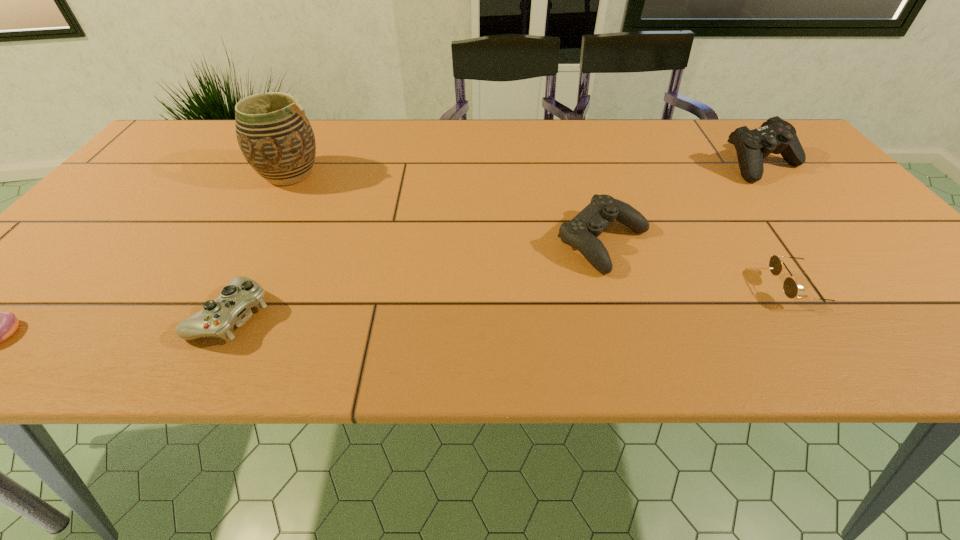
I want to click on free location at the right edge, so click(x=802, y=216).

In the image, there is a desktop. Identify the location of vacant space at the far left corner. (216, 141).

This screenshot has width=960, height=540. In order to click on free spot between the leftmost control and the sunglasses in this screenshot , I will do point(515,302).

At what (x,y) coordinates should I click in order to perform the action: click on empty location between the farthest control and the sunglasses. Please return your answer as a coordinate pair (x, y). This screenshot has height=540, width=960. Looking at the image, I should click on (780, 227).

The height and width of the screenshot is (540, 960). I want to click on free space between the second tallest object and the sunglasses, so tap(780, 227).

Where is `free space between the pottery and the nearest control`? The image size is (960, 540). free space between the pottery and the nearest control is located at coordinates click(x=260, y=244).

Identify the location of empty space between the sunglasses and the rightmost control. (780, 227).

Locate an element on the screen. The width and height of the screenshot is (960, 540). object that is the fifth closest one to the leftmost object is located at coordinates (776, 136).

Image resolution: width=960 pixels, height=540 pixels. Find the location of `object that can be found as the fourth closest to the fifth shortest object`. object that can be found as the fourth closest to the fifth shortest object is located at coordinates (231, 308).

This screenshot has width=960, height=540. Find the location of `control that is the closest one to the tallest object`. control that is the closest one to the tallest object is located at coordinates (231, 308).